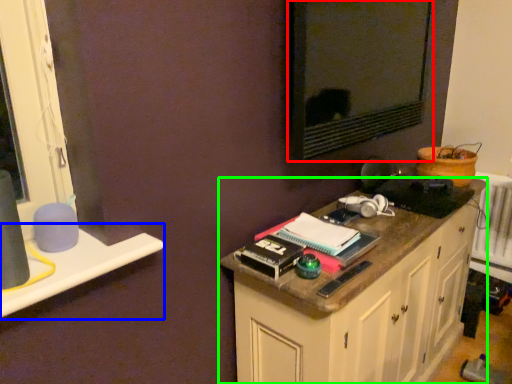
Question: Which object is the closest to the wide (highlighted by a red box)? Choose among these: window sill (highlighted by a blue box) or cabinetry (highlighted by a green box).

Choices:
 (A) window sill
 (B) cabinetry

Answer: (B)